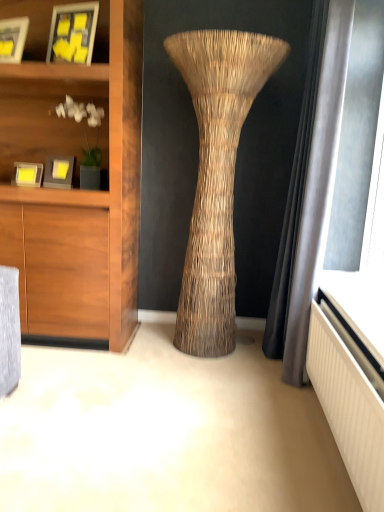
How much space does matte yellow paper at upper left, the fourth picture frame in the bottom-to-top sequence, occupy vertically?

matte yellow paper at upper left, the fourth picture frame in the bottom-to-top sequence, is 35.55 centimeters tall.

Measure the distance between natural woven vase at center and camera.

natural woven vase at center is 2.08 meters from camera.

Image resolution: width=384 pixels, height=512 pixels. Describe the element at coordinates (59, 172) in the screenshot. I see `matte gray picture frame at left, arranged as the 3th picture frame when viewed from the top` at that location.

What are the coordinates of `matte yellow picture frame at left, arranged as the 1th picture frame when ordered from the bottom` in the screenshot? It's located at (28, 174).

Identify the location of matte gray shelf at upper left. This screenshot has width=384, height=512. (49, 113).

Where is `matte yellow paper at upper left, the fourth picture frame in the bottom-to-top sequence`? The height and width of the screenshot is (512, 384). matte yellow paper at upper left, the fourth picture frame in the bottom-to-top sequence is located at coordinates (73, 33).

How much distance is there between natural woven vase at center and matte yellow paper at upper left, the first picture frame viewed from the top?

The distance of natural woven vase at center from matte yellow paper at upper left, the first picture frame viewed from the top, is 82.83 centimeters.

From a real-world perspective, does natural woven vase at center sit lower than matte yellow paper at upper left, the fourth picture frame in the bottom-to-top sequence?

Yes, from a real-world perspective, natural woven vase at center is below matte yellow paper at upper left, the fourth picture frame in the bottom-to-top sequence.

Is matte yellow paper at upper left, the first picture frame viewed from the top, surrounded by natural woven vase at center?

No.

What's the angular difference between natural woven vase at center and matte yellow paper at upper left, the fourth picture frame in the bottom-to-top sequence,'s facing directions?

19.4 degrees separate the facing orientations of natural woven vase at center and matte yellow paper at upper left, the fourth picture frame in the bottom-to-top sequence.

Which is less distant, (15, 138) or (27, 31)?

Positioned in front is point (27, 31).

Is matte gray shelf at upper left bigger or smaller than matte black picture frame at upper left, the third picture frame positioned from the bottom?

Considering their sizes, matte gray shelf at upper left takes up more space than matte black picture frame at upper left, the third picture frame positioned from the bottom.

Can you confirm if matte gray shelf at upper left is wider than matte black picture frame at upper left, which ranks as the second picture frame in top-to-bottom order?

Indeed, matte gray shelf at upper left has a greater width compared to matte black picture frame at upper left, which ranks as the second picture frame in top-to-bottom order.

Which object is positioned more to the left, matte gray shelf at upper left or matte black picture frame at upper left, which ranks as the second picture frame in top-to-bottom order?

matte black picture frame at upper left, which ranks as the second picture frame in top-to-bottom order, is more to the left.

From the picture: Is matte yellow paper at upper left, the first picture frame viewed from the top, not within matte gray picture frame at left, arranged as the 3th picture frame when viewed from the top?

Yes.

From the picture: Is matte yellow paper at upper left, the fourth picture frame in the bottom-to-top sequence, to the left or to the right of matte gray picture frame at left, which is the second picture frame in bottom-to-top order, in the image?

In the image, matte yellow paper at upper left, the fourth picture frame in the bottom-to-top sequence, appears on the right side of matte gray picture frame at left, which is the second picture frame in bottom-to-top order.

Consider the image. From the image's perspective, is matte yellow paper at upper left, the fourth picture frame in the bottom-to-top sequence, above or below matte gray picture frame at left, which is the second picture frame in bottom-to-top order?

matte yellow paper at upper left, the fourth picture frame in the bottom-to-top sequence, is above matte gray picture frame at left, which is the second picture frame in bottom-to-top order.

Which is in front, point (75, 12) or point (73, 168)?

The point (75, 12) is more forward.

Considering the points (86, 38) and (52, 94), which point is behind, point (86, 38) or point (52, 94)?

The point (52, 94) is farther.

Can you confirm if matte yellow paper at upper left, the fourth picture frame in the bottom-to-top sequence, is taller than matte gray shelf at upper left?

Incorrect, the height of matte yellow paper at upper left, the fourth picture frame in the bottom-to-top sequence, is not larger of that of matte gray shelf at upper left.

Considering the sizes of objects matte yellow paper at upper left, the fourth picture frame in the bottom-to-top sequence, and matte gray shelf at upper left in the image provided, who is bigger, matte yellow paper at upper left, the fourth picture frame in the bottom-to-top sequence, or matte gray shelf at upper left?

matte gray shelf at upper left is bigger.

From a real-world perspective, is matte yellow paper at upper left, the fourth picture frame in the bottom-to-top sequence, located higher than matte gray shelf at upper left?

Answer: Indeed, from a real-world perspective, matte yellow paper at upper left, the fourth picture frame in the bottom-to-top sequence, stands above matte gray shelf at upper left.

Does matte gray picture frame at left, which is the second picture frame in bottom-to-top order, appear on the left side of matte yellow paper at upper left, the first picture frame viewed from the top?

Yes.

Is matte gray picture frame at left, which is the second picture frame in bottom-to-top order, located outside matte yellow paper at upper left, the fourth picture frame in the bottom-to-top sequence?

Absolutely, matte gray picture frame at left, which is the second picture frame in bottom-to-top order, is external to matte yellow paper at upper left, the fourth picture frame in the bottom-to-top sequence.

Is matte gray picture frame at left, which is the second picture frame in bottom-to-top order, touching matte yellow paper at upper left, the fourth picture frame in the bottom-to-top sequence?

matte gray picture frame at left, which is the second picture frame in bottom-to-top order, is not next to matte yellow paper at upper left, the fourth picture frame in the bottom-to-top sequence, and they're not touching.

From a real-world perspective, does matte gray picture frame at left, arranged as the 3th picture frame when viewed from the top, sit lower than matte yellow paper at upper left, the fourth picture frame in the bottom-to-top sequence?

Yes, from a real-world perspective, matte gray picture frame at left, arranged as the 3th picture frame when viewed from the top, is beneath matte yellow paper at upper left, the fourth picture frame in the bottom-to-top sequence.

Which is correct: matte yellow paper at upper left, the first picture frame viewed from the top, is inside natural woven vase at center, or outside of it?

matte yellow paper at upper left, the first picture frame viewed from the top, is not inside natural woven vase at center, it's outside.

Can you confirm if matte yellow paper at upper left, the fourth picture frame in the bottom-to-top sequence, is positioned to the right of natural woven vase at center?

Incorrect, matte yellow paper at upper left, the fourth picture frame in the bottom-to-top sequence, is not on the right side of natural woven vase at center.

From the image's perspective, which is below, matte yellow paper at upper left, the first picture frame viewed from the top, or natural woven vase at center?

From the image's view, natural woven vase at center is below.

How much distance is there between matte gray shelf at upper left and natural woven vase at center?

88.05 centimeters.

Does matte gray shelf at upper left turn towards natural woven vase at center?

No, matte gray shelf at upper left is not turned towards natural woven vase at center.

From the image's perspective, is matte gray shelf at upper left located above natural woven vase at center?

Yes, from the image's perspective, matte gray shelf at upper left is over natural woven vase at center.

Is matte gray shelf at upper left closer to camera compared to natural woven vase at center?

No, matte gray shelf at upper left is further to the viewer.

Where is `picture frame that is the 4th object above the natural woven vase at center (from a real-world perspective)`? Image resolution: width=384 pixels, height=512 pixels. picture frame that is the 4th object above the natural woven vase at center (from a real-world perspective) is located at coordinates 73,33.

In the image, there is a matte black picture frame at upper left, the third picture frame positioned from the bottom. At what (x,y) coordinates should I click in order to perform the action: click on shelf below it (from a real-world perspective). Please return your answer as a coordinate pair (x, y). Looking at the image, I should click on (49, 113).

Based on their spatial positions, is matte gray shelf at upper left or natural woven vase at center closer to matte gray picture frame at left, which is the second picture frame in bottom-to-top order?

The object closer to matte gray picture frame at left, which is the second picture frame in bottom-to-top order, is matte gray shelf at upper left.

Considering their positions, is matte black picture frame at upper left, which ranks as the second picture frame in top-to-bottom order, positioned closer to matte yellow paper at upper left, the fourth picture frame in the bottom-to-top sequence, than natural woven vase at center?

Among the two, matte black picture frame at upper left, which ranks as the second picture frame in top-to-bottom order, is located nearer to matte yellow paper at upper left, the fourth picture frame in the bottom-to-top sequence.

Considering their positions, is matte black picture frame at upper left, the third picture frame positioned from the bottom, positioned closer to matte yellow picture frame at left, the fourth picture frame positioned from the top, than matte gray picture frame at left, arranged as the 3th picture frame when viewed from the top?

matte gray picture frame at left, arranged as the 3th picture frame when viewed from the top.

Based on their spatial positions, is natural woven vase at center or matte gray picture frame at left, which is the second picture frame in bottom-to-top order, closer to matte gray shelf at upper left?

Among the two, matte gray picture frame at left, which is the second picture frame in bottom-to-top order, is located nearer to matte gray shelf at upper left.

From the image, which object appears to be farther from matte black picture frame at upper left, which ranks as the second picture frame in top-to-bottom order, matte yellow picture frame at left, arranged as the 1th picture frame when ordered from the bottom, or matte yellow paper at upper left, the fourth picture frame in the bottom-to-top sequence?

matte yellow picture frame at left, arranged as the 1th picture frame when ordered from the bottom.

Considering their positions, is matte gray shelf at upper left positioned closer to matte yellow paper at upper left, the fourth picture frame in the bottom-to-top sequence, than natural woven vase at center?

matte gray shelf at upper left is positioned closer to the anchor matte yellow paper at upper left, the fourth picture frame in the bottom-to-top sequence.

When comparing their distances from matte yellow paper at upper left, the fourth picture frame in the bottom-to-top sequence, does matte black picture frame at upper left, the third picture frame positioned from the bottom, or matte yellow picture frame at left, arranged as the 1th picture frame when ordered from the bottom, seem closer?

The object closer to matte yellow paper at upper left, the fourth picture frame in the bottom-to-top sequence, is matte black picture frame at upper left, the third picture frame positioned from the bottom.

Estimate the real-world distances between objects in this image. Which object is closer to matte yellow picture frame at left, arranged as the 1th picture frame when ordered from the bottom, natural woven vase at center or matte gray shelf at upper left?

matte gray shelf at upper left lies closer to matte yellow picture frame at left, arranged as the 1th picture frame when ordered from the bottom, than the other object.

The height and width of the screenshot is (512, 384). I want to click on picture frame located between matte gray picture frame at left, which is the second picture frame in bottom-to-top order, and natural woven vase at center in the left-right direction, so click(x=73, y=33).

Identify the location of shelf situated between matte black picture frame at upper left, which ranks as the second picture frame in top-to-bottom order, and natural woven vase at center from left to right. The width and height of the screenshot is (384, 512). (49, 113).

Where is `picture frame located between matte yellow picture frame at left, the fourth picture frame positioned from the top, and matte gray shelf at upper left in the left-right direction`? The height and width of the screenshot is (512, 384). picture frame located between matte yellow picture frame at left, the fourth picture frame positioned from the top, and matte gray shelf at upper left in the left-right direction is located at coordinates (59, 172).

I want to click on picture frame between matte yellow paper at upper left, the first picture frame viewed from the top, and matte gray shelf at upper left in the up-down direction, so click(13, 39).